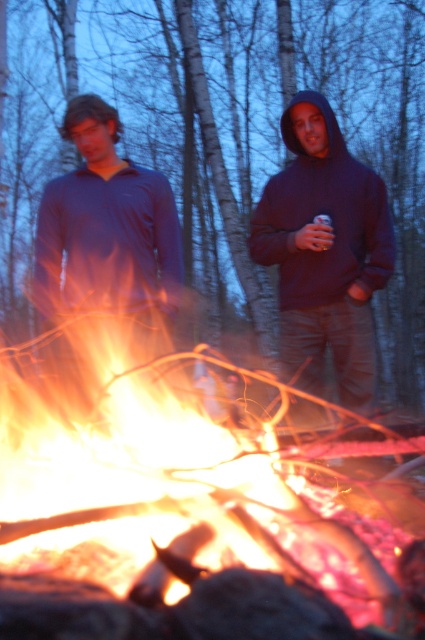
Describe the element at coordinates (175, 512) in the screenshot. The width and height of the screenshot is (425, 640). I see `flaming wood at center` at that location.

Looking at this image, is flaming wood at center further to camera compared to matte blue shirt at left?

No, it is not.

Who is more forward, (x=42, y=518) or (x=76, y=228)?

Point (x=42, y=518) is more forward.

You are a GUI agent. You are given a task and a screenshot of the screen. Output one action in this format:
    pyautogui.click(x=<x>, y=<y>)
    Task: Click on the flaming wood at center
    The image size is (425, 640).
    Given the screenshot: What is the action you would take?
    pyautogui.click(x=175, y=512)

Between dark blue hoodie at center and matte blue shirt at left, which one appears on the right side from the viewer's perspective?

dark blue hoodie at center is more to the right.

Is dark blue hoodie at center shorter than matte blue shirt at left?

No, dark blue hoodie at center is not shorter than matte blue shirt at left.

Identify the location of dark blue hoodie at center. The height and width of the screenshot is (640, 425). (x=325, y=252).

Which of these two, flaming wood at center or matte blue hoodie at center, stands taller?

matte blue hoodie at center is taller.

Does flaming wood at center appear under matte blue hoodie at center?

Indeed, flaming wood at center is positioned under matte blue hoodie at center.

Where is `flaming wood at center`? flaming wood at center is located at coordinates (175, 512).